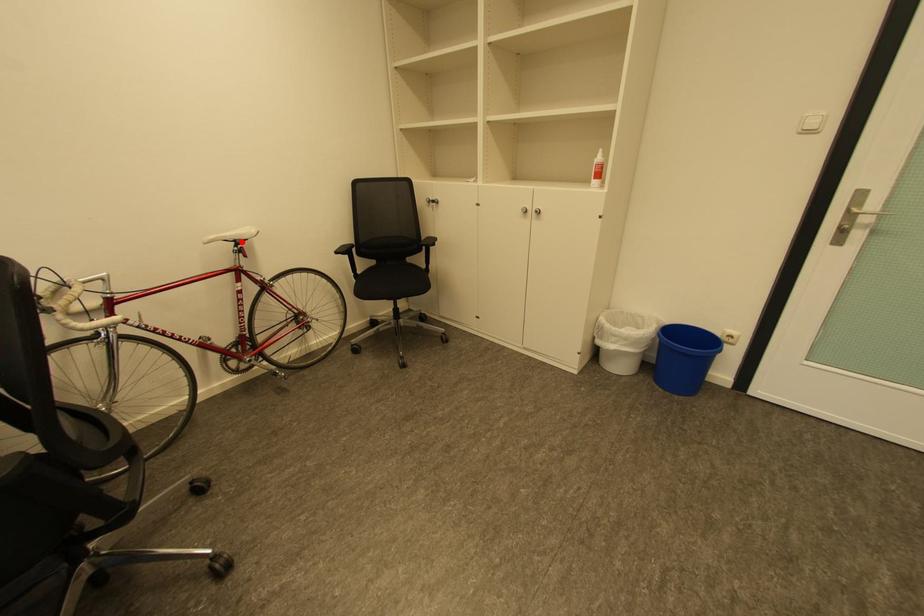
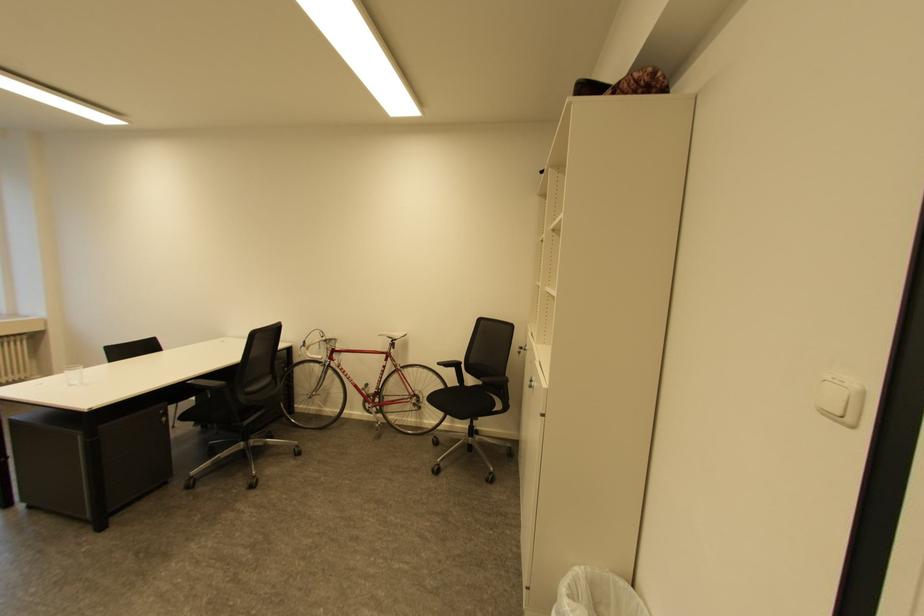
Question: I am providing you with two images of the same scene from different viewpoints. In image1, a red point is highlighted. Considering the same 3D point in image2, which of the following is correct?

Choices:
 (A) It is closer
 (B) It is farther

Answer: (B)